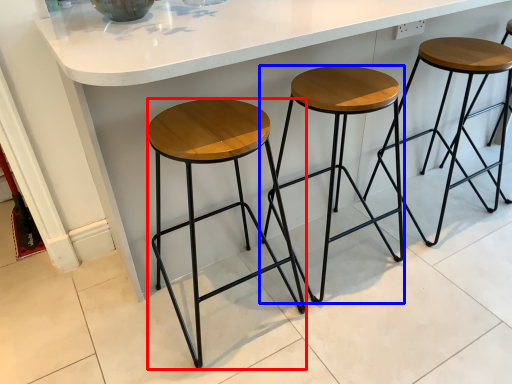
Question: Which of the following is the farthest to the observer, stool (highlighted by a red box) or stool (highlighted by a blue box)?

Choices:
 (A) stool
 (B) stool

Answer: (B)